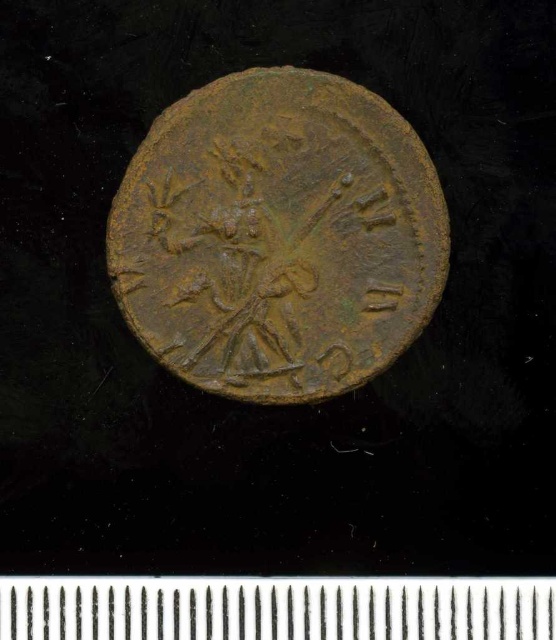
You are an archaeologist examining the scene. You need to determine which object is thinner between the rusty bronze coin at center and the metallic silver ruler at center. Which one is thinner?

The rusty bronze coin at center is thinner than the metallic silver ruler at center according to the description.

You are an archaeologist examining a circular object on a dark surface. You notice the rusty bronze coin at center. Based on its position, can you determine its exact coordinates on the surface?

The rusty bronze coin at center is located at coordinates 0.370 on the x axis and 0.500 on the y axis.

You are an archaeologist who has discovered two items in a dig site. You have a rusty bronze coin at center and a metallic silver ruler at center. You need to place them in a storage box that can only accommodate items within 50 centimeters of each other. Will these two items fit in the box together?

The distance between the rusty bronze coin at center and metallic silver ruler at center is 55.29 centimeters, which exceeds the 50 centimeter limit. Therefore, they cannot be placed together in the storage box.